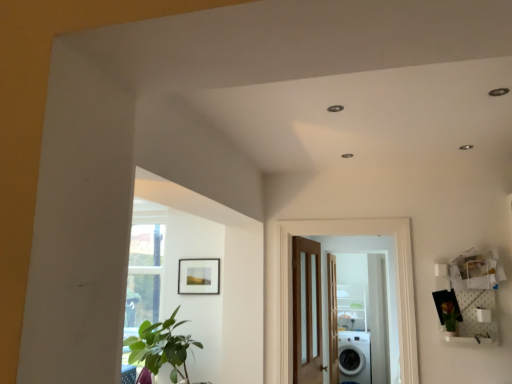
In order to face green leafy plant at right, should I rotate leftwards or rightwards?

You should look right and rotate roughly 24.388 degrees.

Image resolution: width=512 pixels, height=384 pixels. What do you see at coordinates (450, 315) in the screenshot?
I see `green leafy plant at right` at bounding box center [450, 315].

The image size is (512, 384). Identify the location of white glossy screen door at center. (362, 318).

In order to face white glossy screen door at center, should I rotate leftwards or rightwards?

A 13.340 degree turn to the right will do.

Identify the location of green leafy plant at lower left. This screenshot has width=512, height=384. (161, 347).

Which object is positioned more to the right, wooden door with glass panels at center, which is the second door from back to front, or clear glass shelf at center?

clear glass shelf at center.

From the picture: From the image's perspective, which object appears higher, wooden door with glass panels at center, acting as the 2th door starting from the front, or clear glass shelf at center?

Result: From the image's view, wooden door with glass panels at center, acting as the 2th door starting from the front, is above.

Is wooden door with glass panels at center, which is the second door from back to front, turned away from clear glass shelf at center?

No, wooden door with glass panels at center, which is the second door from back to front, is not facing the opposite direction of clear glass shelf at center.

Is there a large distance between wooden door with glass panels at center, acting as the 2th door starting from the front, and clear glass shelf at center?

Yes, wooden door with glass panels at center, acting as the 2th door starting from the front, and clear glass shelf at center are located far from each other.

Is white glossy screen door at center wider than wooden door with glass panels at center, acting as the 2th door starting from the front?

No.

Find the location of a particular element. This screenshot has width=512, height=384. screen door to the right of wooden door with glass panels at center, acting as the 2th door starting from the front is located at coordinates (362, 318).

How far apart are white glossy screen door at center and wooden door with glass panels at center, which is the second door from back to front?

white glossy screen door at center and wooden door with glass panels at center, which is the second door from back to front, are 8.02 feet apart from each other.

Does point (339, 356) appear closer or farther from the camera than point (303, 322)?

Point (339, 356) appears to be farther away from the viewer than point (303, 322).

Is wooden door with glass panels at center, acting as the 2th door starting from the front, taller or shorter than white glossy washing machine at lower right?

wooden door with glass panels at center, acting as the 2th door starting from the front, is taller than white glossy washing machine at lower right.

From a real-world perspective, is wooden door with glass panels at center, acting as the 2th door starting from the front, below white glossy washing machine at lower right?

No, from a real-world perspective, wooden door with glass panels at center, acting as the 2th door starting from the front, is not below white glossy washing machine at lower right.

Based on their positions, is wooden door with glass panels at center, which is the second door from back to front, located to the left or right of white glossy washing machine at lower right?

In the image, wooden door with glass panels at center, which is the second door from back to front, appears on the left side of white glossy washing machine at lower right.

Is wooden door with glass panels at center, acting as the 2th door starting from the front, facing towards white glossy washing machine at lower right?

No, wooden door with glass panels at center, acting as the 2th door starting from the front, is not facing towards white glossy washing machine at lower right.

In the scene shown: Is brown wooden door at center, the third door viewed from the back, not close to white glossy washing machine at lower right?

Yes, brown wooden door at center, the third door viewed from the back, is far from white glossy washing machine at lower right.

Identify the location of washing machine behind the brown wooden door at center, the third door viewed from the back. The width and height of the screenshot is (512, 384). pyautogui.click(x=354, y=356).

Is brown wooden door at center, the 1th door positioned from the front, wider than white glossy washing machine at lower right?

No, brown wooden door at center, the 1th door positioned from the front, is not wider than white glossy washing machine at lower right.

Relative to white glossy washing machine at lower right, is brown wooden door at center, the 1th door positioned from the front, in front or behind?

brown wooden door at center, the 1th door positioned from the front, is positioned closer to the viewer than white glossy washing machine at lower right.

Which is correct: white glossy washing machine at lower right is inside green leafy plant at lower left, or outside of it?

white glossy washing machine at lower right is outside green leafy plant at lower left.

From the image's perspective, is white glossy washing machine at lower right located beneath green leafy plant at lower left?

Yes.

In the scene shown: Considering the sizes of objects white glossy washing machine at lower right and green leafy plant at lower left in the image provided, who is taller, white glossy washing machine at lower right or green leafy plant at lower left?

Standing taller between the two is white glossy washing machine at lower right.

Does point (212, 268) come farther from viewer compared to point (368, 294)?

No, (212, 268) is in front of (368, 294).

Is matte wooden picture frame at upper center far from white glossy screen door at center?

Yes, matte wooden picture frame at upper center and white glossy screen door at center are located far from each other.

Between matte wooden picture frame at upper center and white glossy screen door at center, which one has smaller width?

Thinner between the two is matte wooden picture frame at upper center.

In the scene shown: Measure the distance between green leafy plant at lower left and white glossy screen door at center.

The distance of green leafy plant at lower left from white glossy screen door at center is 3.04 meters.

From their relative heights in the image, would you say green leafy plant at lower left is taller or shorter than white glossy screen door at center?

green leafy plant at lower left is shorter than white glossy screen door at center.

Relative to white glossy screen door at center, is green leafy plant at lower left in front or behind?

green leafy plant at lower left is in front of white glossy screen door at center.

From the image's perspective, which is above, green leafy plant at lower left or white glossy screen door at center?

green leafy plant at lower left, from the image's perspective.

Locate an element on the screen. The width and height of the screenshot is (512, 384). shelf that is behind the wooden door with glass panels at center, acting as the 2th door starting from the front is located at coordinates (351, 307).

At what (x,y) coordinates should I click in order to perform the action: click on the 1st door in front of the white glossy screen door at center, counting from the anchor's position. Please return your answer as a coordinate pair (x, y). This screenshot has height=384, width=512. Looking at the image, I should click on (307, 312).

From the image, which object appears to be farther from white glossy screen door at center, white glossy washing machine at lower right or brown wooden door at center, the 1th door positioned from the front?

brown wooden door at center, the 1th door positioned from the front, lies further to white glossy screen door at center than the other object.

Estimate the real-world distances between objects in this image. Which object is closer to white glossy washing machine at lower right, white glossy screen door at center or wooden door with glass panels at center, which is the second door from back to front?

Based on the image, white glossy screen door at center appears to be nearer to white glossy washing machine at lower right.

Considering their positions, is matte wooden picture frame at upper center positioned further to green leafy plant at lower left than clear glass shelf at center?

clear glass shelf at center is positioned further to the anchor green leafy plant at lower left.

When comparing their distances from wooden door at center, the 3th door when ordered from front to back, does white glossy screen door at center or white glossy washing machine at lower right seem closer?

Among the two, white glossy washing machine at lower right is located nearer to wooden door at center, the 3th door when ordered from front to back.

Based on their spatial positions, is brown wooden door at center, the 1th door positioned from the front, or green leafy plant at lower left further from white glossy screen door at center?

brown wooden door at center, the 1th door positioned from the front, is further to white glossy screen door at center.

Consider the image. Estimate the real-world distances between objects in this image. Which object is closer to green leafy plant at lower left, brown wooden door at center, the third door viewed from the back, or clear glass shelf at center?

brown wooden door at center, the third door viewed from the back, lies closer to green leafy plant at lower left than the other object.

Estimate the real-world distances between objects in this image. Which object is further from clear glass shelf at center, white glossy washing machine at lower right or white glossy screen door at center?

Based on the image, white glossy washing machine at lower right appears to be further to clear glass shelf at center.

Estimate the real-world distances between objects in this image. Which object is closer to wooden door at center, marked as the first door in a back-to-front arrangement, wooden door with glass panels at center, acting as the 2th door starting from the front, or matte wooden picture frame at upper center?

Among the two, wooden door with glass panels at center, acting as the 2th door starting from the front, is located nearer to wooden door at center, marked as the first door in a back-to-front arrangement.

This screenshot has height=384, width=512. In order to click on picture frame between green leafy plant at lower left and clear glass shelf at center in the front-back direction in this screenshot , I will do `click(199, 276)`.

Locate an element on the screen. picture frame between green leafy plant at right and white glossy screen door at center along the z-axis is located at coordinates (199, 276).

Locate an element on the screen. The height and width of the screenshot is (384, 512). washing machine positioned between matte wooden picture frame at upper center and clear glass shelf at center from near to far is located at coordinates click(354, 356).

Find the location of a particular element. Image resolution: width=512 pixels, height=384 pixels. houseplant positioned between green leafy plant at right and white glossy screen door at center from near to far is located at coordinates (161, 347).